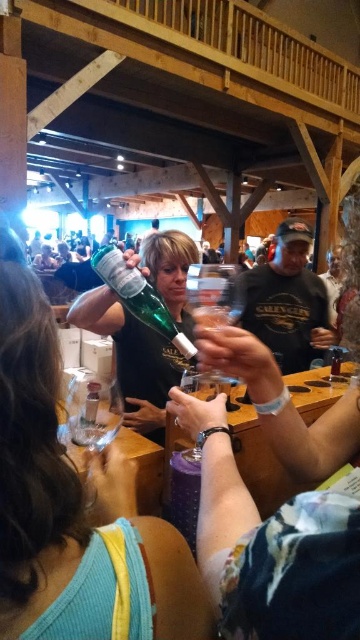
Is matte green glass bottle at center further to the viewer compared to green glass bottle at center?

No, matte green glass bottle at center is closer to the viewer.

The height and width of the screenshot is (640, 360). I want to click on matte green glass bottle at center, so click(74, 509).

Is point (15, 280) behind point (125, 272)?

No, (15, 280) is closer to viewer.

In order to click on matte green glass bottle at center in this screenshot , I will do `click(74, 509)`.

Can you confirm if matte green glass bottle at center is positioned to the right of transparent plastic wine glass at center?

In fact, matte green glass bottle at center is to the left of transparent plastic wine glass at center.

Between matte green glass bottle at center and transparent plastic wine glass at center, which one appears on the right side from the viewer's perspective?

From the viewer's perspective, transparent plastic wine glass at center appears more on the right side.

The image size is (360, 640). What do you see at coordinates (74, 509) in the screenshot?
I see `matte green glass bottle at center` at bounding box center [74, 509].

The height and width of the screenshot is (640, 360). Find the location of `matte green glass bottle at center`. matte green glass bottle at center is located at coordinates (74, 509).

Between point (177, 333) and point (87, 384), which one is positioned in front?

Point (177, 333)

Is green glass bottle at center thinner than clear glass bottle at center?

No.

Which is behind, point (195, 358) or point (96, 410)?

The point (96, 410) is more distant.

Identify the location of green glass bottle at center. (140, 298).